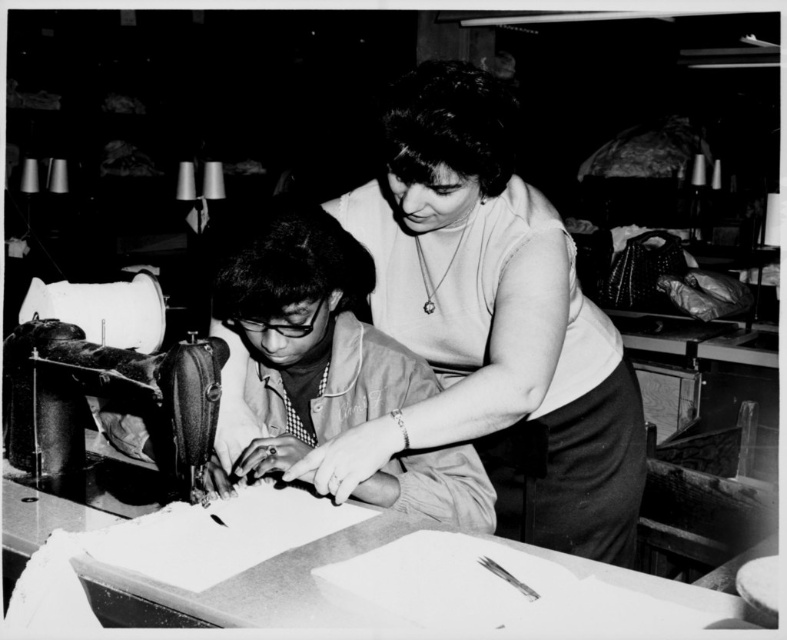
Question: Which point is farther from the camera taking this photo?

Choices:
 (A) (418, 403)
 (B) (276, 260)

Answer: (A)

Question: Which of these objects is positioned closest to the smooth beige shirt at center?

Choices:
 (A) metallic sewing machine at left
 (B) smooth white blouse at center

Answer: (B)

Question: Does smooth white blouse at center lie behind metallic sewing machine at left?

Choices:
 (A) yes
 (B) no

Answer: (B)

Question: Is smooth beige shirt at center positioned at the back of metallic sewing machine at left?

Choices:
 (A) yes
 (B) no

Answer: (A)

Question: Is smooth white blouse at center to the left of smooth beige shirt at center from the viewer's perspective?

Choices:
 (A) yes
 (B) no

Answer: (B)

Question: Which of the following is the closest to the observer?

Choices:
 (A) (516, 225)
 (B) (307, 317)
 (C) (200, 372)

Answer: (C)